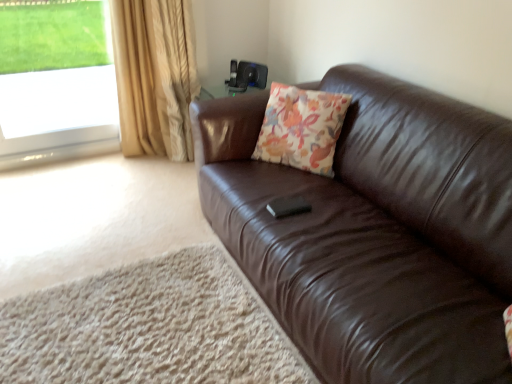
The width and height of the screenshot is (512, 384). I want to click on floral fabric cushion at center, so click(x=301, y=128).

This screenshot has width=512, height=384. Describe the element at coordinates (375, 231) in the screenshot. I see `brown leather couch at right` at that location.

Find the location of a particular element. The width and height of the screenshot is (512, 384). gold textured curtain at left is located at coordinates (155, 76).

Considering the relative sizes of gold textured curtain at left and floral fabric cushion at center in the image provided, is gold textured curtain at left thinner than floral fabric cushion at center?

Incorrect, the width of gold textured curtain at left is not less than that of floral fabric cushion at center.

Is gold textured curtain at left oriented towards floral fabric cushion at center?

Yes, gold textured curtain at left faces towards floral fabric cushion at center.

From a real-world perspective, which object rests below the other?

In real-world perspective, gold textured curtain at left is lower.

Considering the relative sizes of transparent glass window at upper left and gold textured curtain at left in the image provided, is transparent glass window at upper left shorter than gold textured curtain at left?

Yes, transparent glass window at upper left is shorter than gold textured curtain at left.

Is transparent glass window at upper left inside the boundaries of gold textured curtain at left, or outside?

transparent glass window at upper left is outside gold textured curtain at left.

In the scene shown: Between transparent glass window at upper left and gold textured curtain at left, which one is positioned in front?

gold textured curtain at left is in front.

Considering the points (78, 135) and (134, 35), which point is in front, point (78, 135) or point (134, 35)?

The point (134, 35) is closer.

Considering the sizes of objects floral fabric cushion at center and transparent glass window at upper left in the image provided, who is wider, floral fabric cushion at center or transparent glass window at upper left?

floral fabric cushion at center.

Identify the location of window located behind the floral fabric cushion at center. Image resolution: width=512 pixels, height=384 pixels. (56, 81).

Is point (273, 122) positioned before point (83, 77)?

Yes, point (273, 122) is closer to viewer.

Considering the positions of objects floral fabric cushion at center and transparent glass window at upper left in the image provided, who is more to the right, floral fabric cushion at center or transparent glass window at upper left?

From the viewer's perspective, floral fabric cushion at center appears more on the right side.

From a real-world perspective, who is located lower, transparent glass window at upper left or floral fabric cushion at center?

From a 3D spatial view, floral fabric cushion at center is below.

Is point (14, 40) positioned in front of point (304, 155)?

No, (14, 40) is further to viewer.

What's the angular difference between transparent glass window at upper left and floral fabric cushion at center's facing directions?

The facing directions of transparent glass window at upper left and floral fabric cushion at center are 51.7 degrees apart.

Considering the relative positions of transparent glass window at upper left and floral fabric cushion at center in the image provided, is transparent glass window at upper left to the left or to the right of floral fabric cushion at center?

transparent glass window at upper left is to the left of floral fabric cushion at center.

Considering the positions of points (150, 61) and (37, 126), is point (150, 61) farther from camera compared to point (37, 126)?

No, it is in front of (37, 126).

In terms of height, does gold textured curtain at left look taller or shorter compared to transparent glass window at upper left?

In the image, gold textured curtain at left appears to be taller than transparent glass window at upper left.

Is gold textured curtain at left facing towards transparent glass window at upper left?

No, gold textured curtain at left is not oriented towards transparent glass window at upper left.

Considering the relative positions of gold textured curtain at left and transparent glass window at upper left in the image provided, is gold textured curtain at left in front of transparent glass window at upper left?

Yes, gold textured curtain at left is closer to the viewer.

The height and width of the screenshot is (384, 512). I want to click on window lying on the left of brown leather couch at right, so click(56, 81).

Considering the sizes of brown leather couch at right and transparent glass window at upper left in the image, is brown leather couch at right wider or thinner than transparent glass window at upper left?

Clearly, brown leather couch at right has more width compared to transparent glass window at upper left.

Is brown leather couch at right at the left side of transparent glass window at upper left?

In fact, brown leather couch at right is to the right of transparent glass window at upper left.

Consider the image. How many degrees apart are the facing directions of brown leather couch at right and transparent glass window at upper left?

The angle between the facing direction of brown leather couch at right and the facing direction of transparent glass window at upper left is 89.3 degrees.

Based on the photo, from a real-world perspective, is gold textured curtain at left located higher than brown leather couch at right?

Yes, from a real-world perspective, gold textured curtain at left is over brown leather couch at right

Do you think gold textured curtain at left is within brown leather couch at right, or outside of it?

gold textured curtain at left is outside brown leather couch at right.

Which point is more forward, (174, 138) or (323, 346)?

The point (323, 346) is closer to the camera.

Is gold textured curtain at left at the right side of brown leather couch at right?

Incorrect, gold textured curtain at left is not on the right side of brown leather couch at right.

You are a GUI agent. You are given a task and a screenshot of the screen. Output one action in this format:
    pyautogui.click(x=<x>, y=<y>)
    Task: Click on the throw pillow to the right of gold textured curtain at left
    The image size is (512, 384).
    Given the screenshot: What is the action you would take?
    pyautogui.click(x=301, y=128)

The height and width of the screenshot is (384, 512). In the image, there is a transparent glass window at upper left. What are the coordinates of `curtain below it (from a real-world perspective)` in the screenshot? It's located at (155, 76).

Consider the image. Looking at the image, which one is located closer to gold textured curtain at left, floral fabric cushion at center or brown leather couch at right?

Among the two, floral fabric cushion at center is located nearer to gold textured curtain at left.

Based on their spatial positions, is gold textured curtain at left or floral fabric cushion at center further from brown leather couch at right?

The object further to brown leather couch at right is gold textured curtain at left.

Looking at this image, considering their positions, is transparent glass window at upper left positioned further to brown leather couch at right than gold textured curtain at left?

Among the two, transparent glass window at upper left is located further to brown leather couch at right.

Looking at the image, which one is located closer to floral fabric cushion at center, gold textured curtain at left or brown leather couch at right?

Among the two, brown leather couch at right is located nearer to floral fabric cushion at center.

Which object lies further to the anchor point transparent glass window at upper left, gold textured curtain at left or floral fabric cushion at center?

floral fabric cushion at center lies further to transparent glass window at upper left than the other object.

Which object lies further to the anchor point transparent glass window at upper left, floral fabric cushion at center or gold textured curtain at left?

Based on the image, floral fabric cushion at center appears to be further to transparent glass window at upper left.

Considering their positions, is transparent glass window at upper left positioned closer to gold textured curtain at left than floral fabric cushion at center?

transparent glass window at upper left is closer to gold textured curtain at left.

Looking at the image, which one is located further to transparent glass window at upper left, floral fabric cushion at center or brown leather couch at right?

brown leather couch at right.

At what (x,y) coordinates should I click in order to perform the action: click on throw pillow between transparent glass window at upper left and brown leather couch at right in the horizontal direction. Please return your answer as a coordinate pair (x, y). Image resolution: width=512 pixels, height=384 pixels. Looking at the image, I should click on (301, 128).

Find the location of a particular element. The height and width of the screenshot is (384, 512). curtain between brown leather couch at right and transparent glass window at upper left along the z-axis is located at coordinates (155, 76).

You are a GUI agent. You are given a task and a screenshot of the screen. Output one action in this format:
    pyautogui.click(x=<x>, y=<y>)
    Task: Click on the throw pillow between brown leather couch at right and gold textured curtain at left in the front-back direction
    
    Given the screenshot: What is the action you would take?
    pyautogui.click(x=301, y=128)

This screenshot has height=384, width=512. Find the location of `curtain between transparent glass window at upper left and floral fabric cushion at center in the horizontal direction`. curtain between transparent glass window at upper left and floral fabric cushion at center in the horizontal direction is located at coordinates (155, 76).